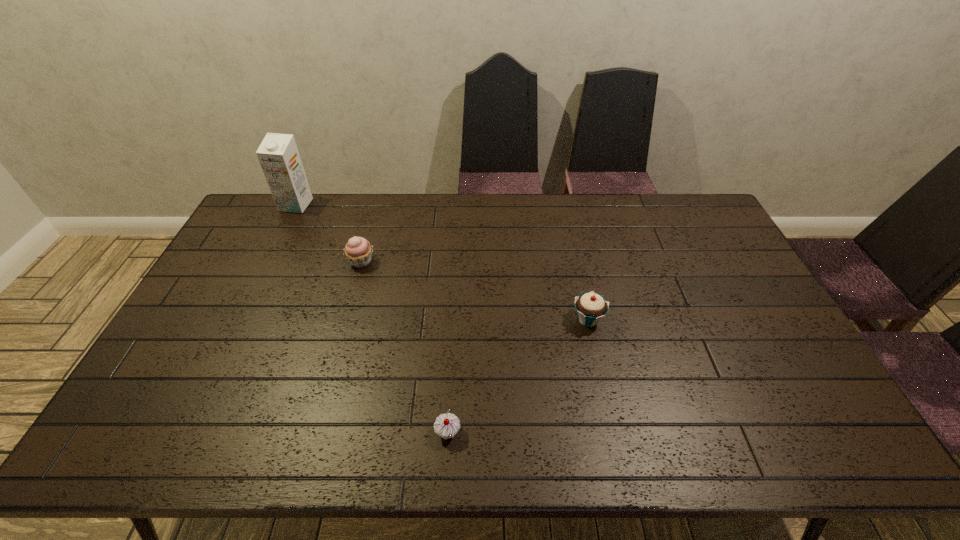
Locate an element on the screen. the farthest object is located at coordinates (278, 155).

Where is `the leftmost object`? This screenshot has height=540, width=960. the leftmost object is located at coordinates (278, 155).

Where is `the third nearest object`? The height and width of the screenshot is (540, 960). the third nearest object is located at coordinates (358, 251).

The width and height of the screenshot is (960, 540). Find the location of `the farthest cupcake`. the farthest cupcake is located at coordinates (358, 251).

I want to click on the rightmost cupcake, so click(591, 307).

I want to click on the second nearest cupcake, so click(591, 307).

The height and width of the screenshot is (540, 960). Identify the location of the nearest object. (447, 425).

The height and width of the screenshot is (540, 960). I want to click on the third object from left to right, so click(x=447, y=425).

Identify the location of vacant space located on the right of the farthest object. This screenshot has width=960, height=540. (357, 205).

You are a GUI agent. You are given a task and a screenshot of the screen. Output one action in this format:
    pyautogui.click(x=<x>, y=<y>)
    Task: Click on the vacant region located 0.260m on the back of the third object from right to left
    
    Given the screenshot: What is the action you would take?
    pyautogui.click(x=376, y=206)